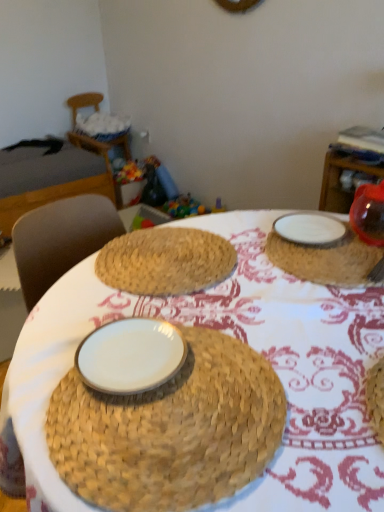
Find the location of a particular element. The height and width of the screenshot is (512, 384). vacant space situated on the left part of white matte plate at upper right, marked as the 2th plate in a front-to-back arrangement is located at coordinates (253, 246).